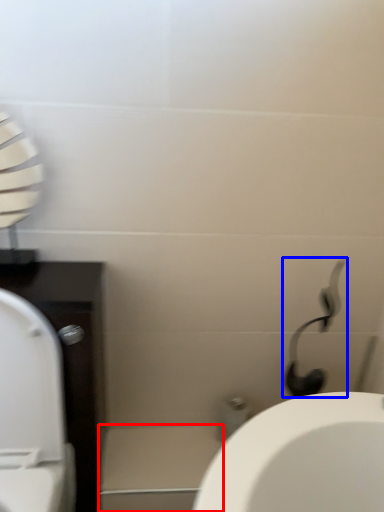
Question: Which object is further to the camera taking this photo, porcelain (highlighted by a red box) or shower (highlighted by a blue box)?

Choices:
 (A) porcelain
 (B) shower

Answer: (A)